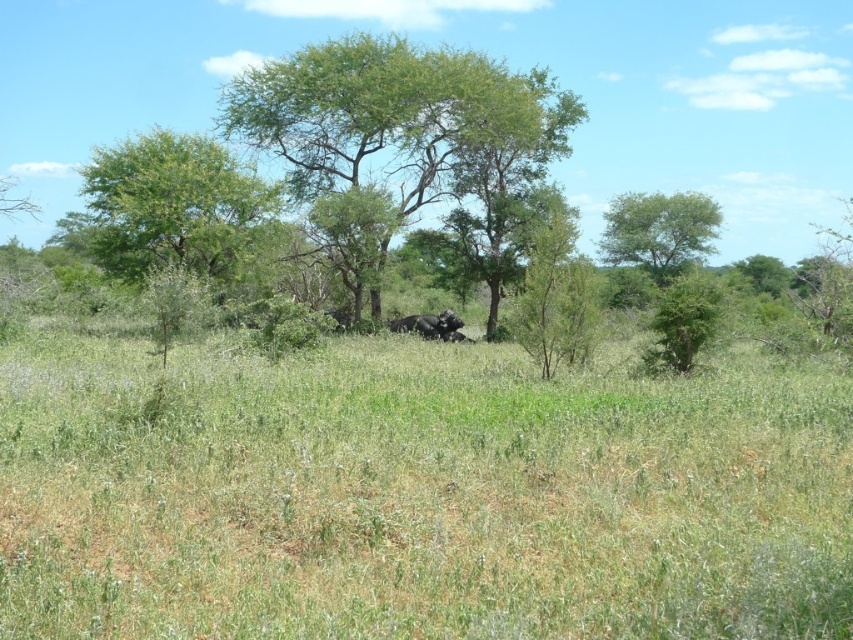
Looking at this image, can you confirm if green leafy tree at center is taller than dark gray elephant at center?

Yes, green leafy tree at center is taller than dark gray elephant at center.

Who is positioned more to the left, green leafy tree at center or dark gray elephant at center?

Answer: green leafy tree at center

Where is `green leafy tree at center`? green leafy tree at center is located at coordinates (408, 125).

Which of these two, green grassy at center or green leafy tree at center, stands shorter?

With less height is green grassy at center.

Is the position of green grassy at center less distant than that of green leafy tree at center?

Yes, green grassy at center is closer to the viewer.

At what (x,y) coordinates should I click in order to perform the action: click on green grassy at center. Please return your answer as a coordinate pair (x, y). This screenshot has width=853, height=640. Looking at the image, I should click on (415, 493).

The image size is (853, 640). I want to click on green grassy at center, so click(x=415, y=493).

Identify the location of green grassy at center. (415, 493).

Can you confirm if green grassy at center is positioned to the left of dark gray elephant at center?

In fact, green grassy at center is to the right of dark gray elephant at center.

Is point (451, 577) behind point (451, 312)?

No, it is in front of (451, 312).

Locate an element on the screen. Image resolution: width=853 pixels, height=640 pixels. green grassy at center is located at coordinates (415, 493).